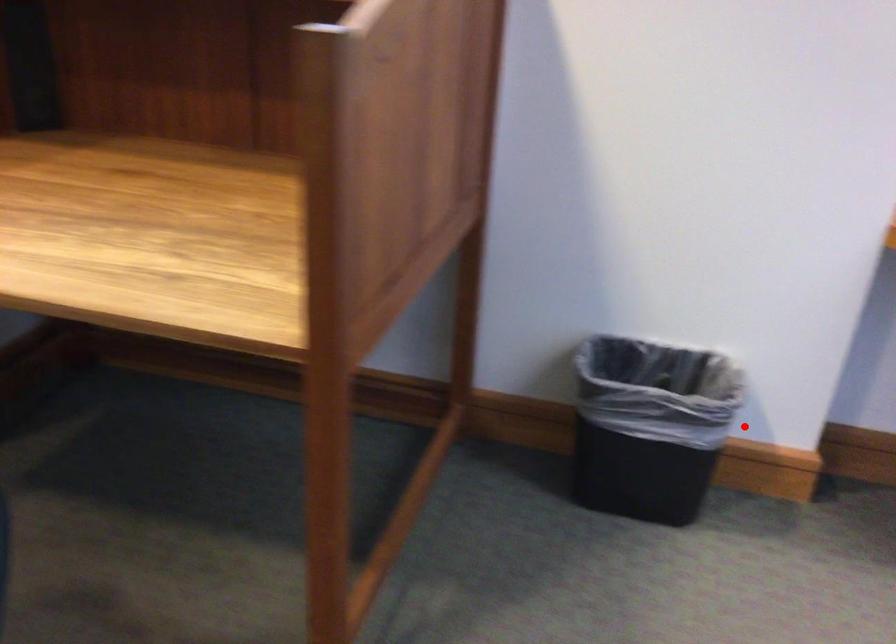
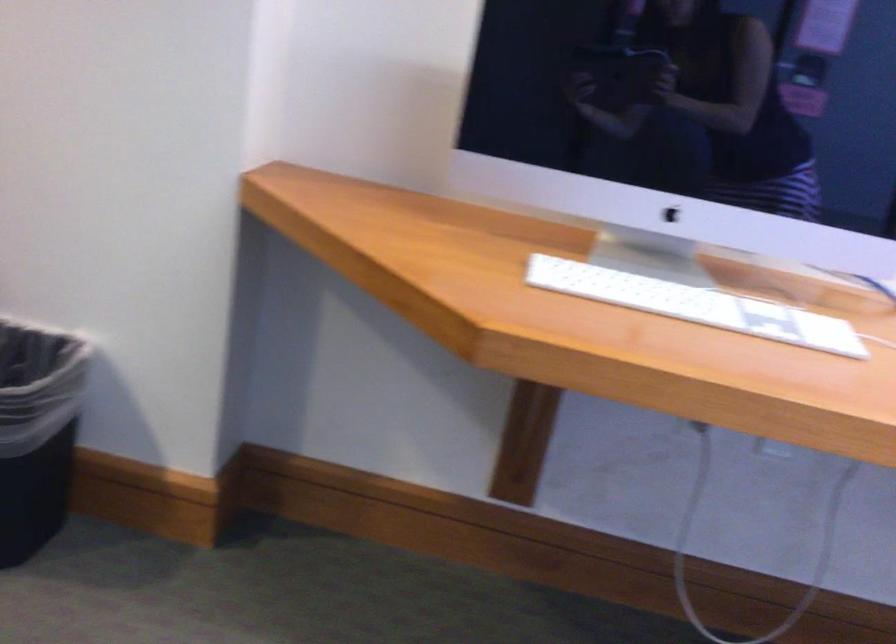
Question: I am providing you with two images of the same scene from different viewpoints. A red point is shown in image1. For the corresponding object point in image2, is it positioned nearer or farther from the camera?

Choices:
 (A) Nearer
 (B) Farther

Answer: (A)